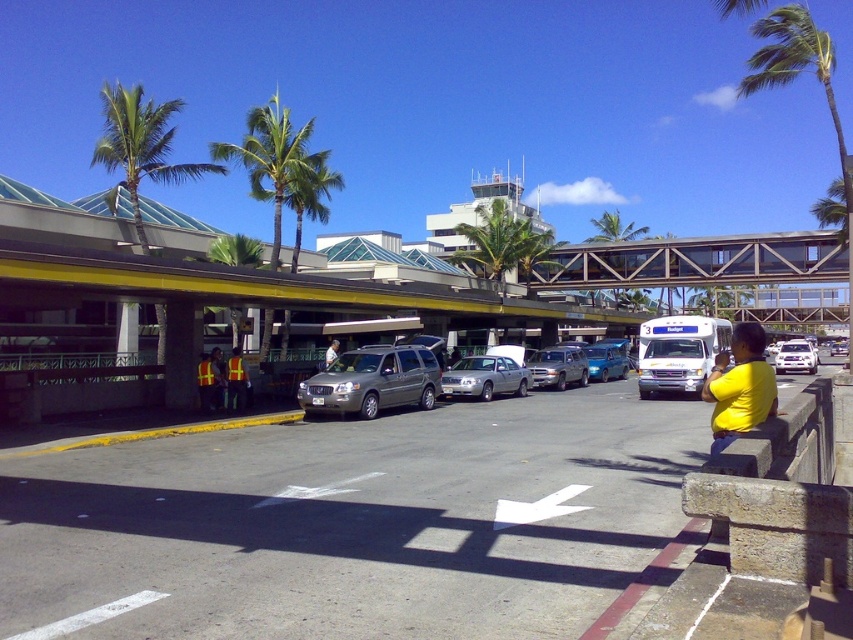
You are standing at the point with coordinates point (140, 147) in the airport terminal scene. What object are you standing on?

The point (140, 147) is on the green leafy palm tree at left, so you are standing on the green leafy palm tree at left.

You are standing at the point with coordinates 0.5, 0.5 in the image. You want to walk to the silver metallic sedan at center. Which direction should you move? Please answer with either north, south, east, or west.

The silver metallic sedan at center is located at coordinates (485,378). Since you are at (426,320), you should move northeast to reach it.

You are a pedestrian standing at the edge of the paved road in the airport terminal area. You notice a green leafy palm tree at left and a reflective yellow vest at center. Which object is higher from the ground?

The green leafy palm tree at left is located above the reflective yellow vest at center, so it is higher from the ground.